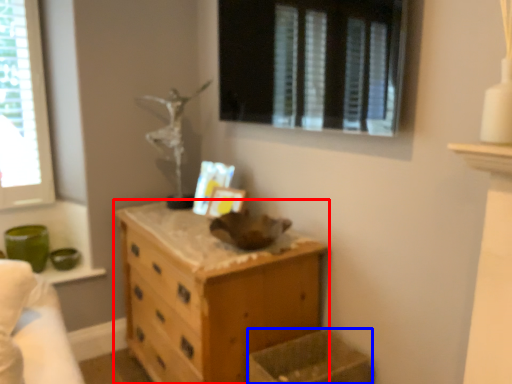
Question: Which object appears closest to the camera in this image, chest of drawers (highlighted by a red box) or crate (highlighted by a blue box)?

Choices:
 (A) chest of drawers
 (B) crate

Answer: (B)